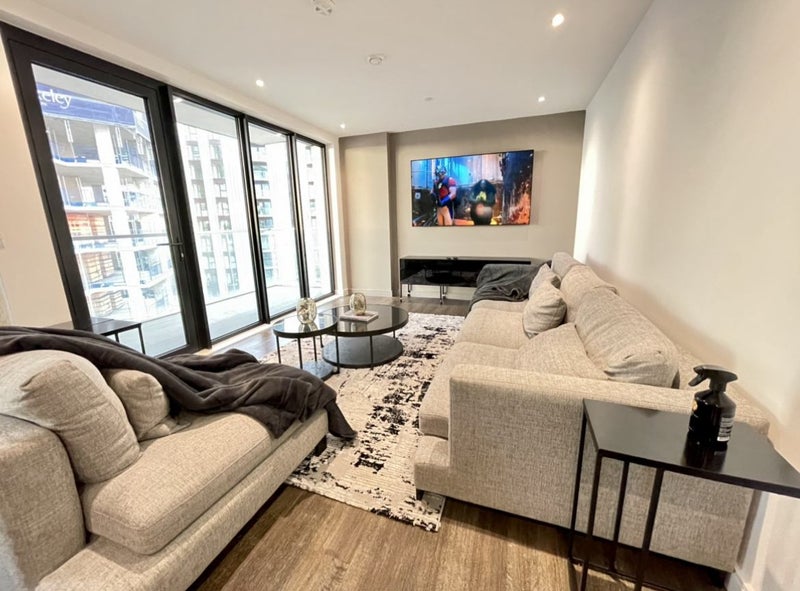
Image resolution: width=800 pixels, height=591 pixels. Identify the location of window. (218, 216).